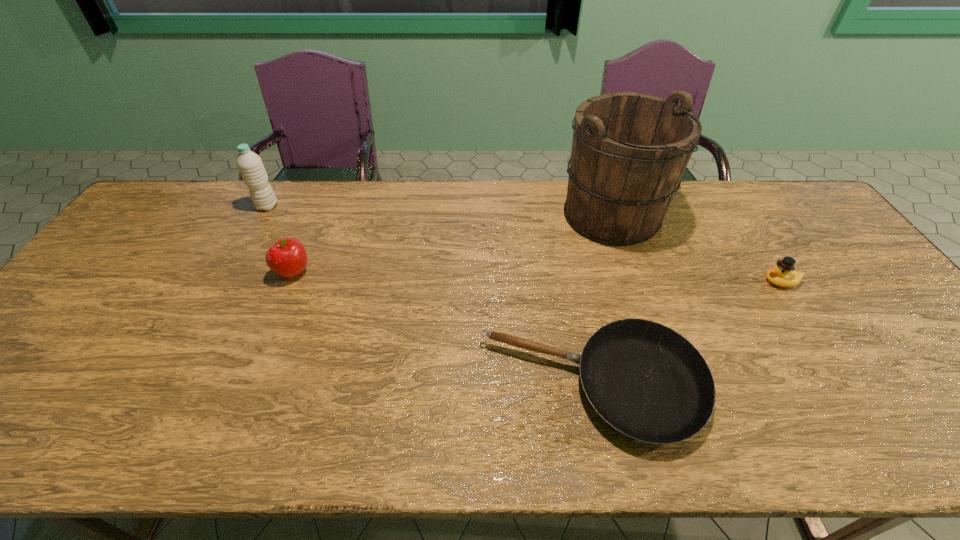
This screenshot has width=960, height=540. I want to click on vacant region located on the back of the leftmost object, so click(277, 188).

Find the location of `free spot located 0.150m on the left of the third tallest object`. free spot located 0.150m on the left of the third tallest object is located at coordinates (222, 273).

Find the location of `blank space located on the front-facing side of the second shortest object`. blank space located on the front-facing side of the second shortest object is located at coordinates click(676, 281).

The height and width of the screenshot is (540, 960). What are the coordinates of `free region located on the front-facing side of the second shortest object` in the screenshot? It's located at (654, 281).

Find the location of a particular element. free space located on the front-facing side of the second shortest object is located at coordinates click(647, 281).

The width and height of the screenshot is (960, 540). Identify the location of free spot located on the left of the shortest object. pyautogui.click(x=400, y=385).

At what (x,y) coordinates should I click in order to perform the action: click on bucket present at the far edge. Please return your answer as a coordinate pair (x, y). Looking at the image, I should click on (629, 151).

Image resolution: width=960 pixels, height=540 pixels. I want to click on water bottle situated at the far edge, so click(250, 165).

The width and height of the screenshot is (960, 540). What are the coordinates of `object that is at the near edge` in the screenshot? It's located at (647, 381).

The width and height of the screenshot is (960, 540). In order to click on vacant space at the far edge of the desktop in this screenshot , I will do `click(437, 213)`.